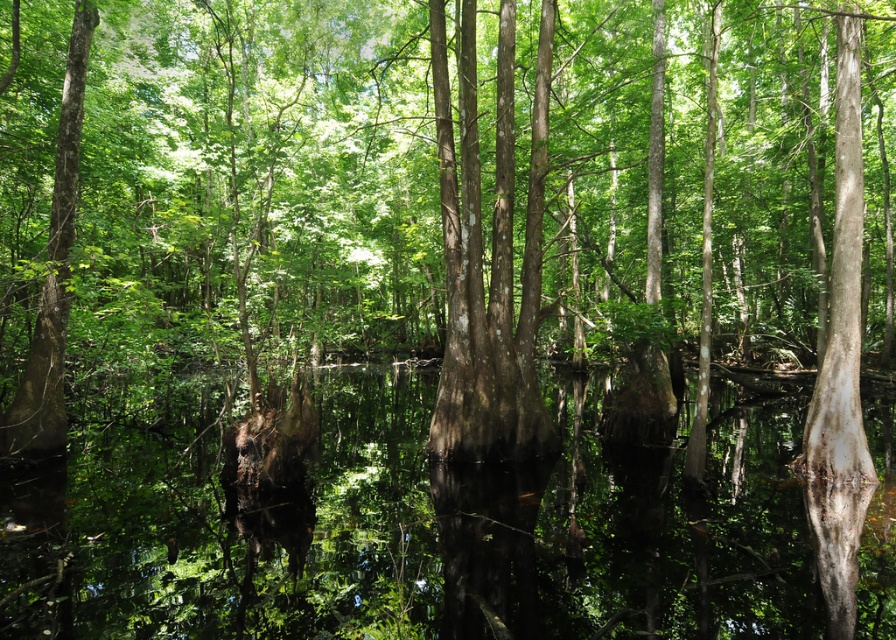
Question: Is smooth bark tree at center wider than transparent water at center?

Choices:
 (A) yes
 (B) no

Answer: (A)

Question: Does smooth bark tree at center have a smaller size compared to transparent water at center?

Choices:
 (A) no
 (B) yes

Answer: (A)

Question: Can you confirm if smooth bark tree at center is positioned to the right of transparent water at center?

Choices:
 (A) no
 (B) yes

Answer: (A)

Question: Which point appears farthest from the camera in this image?

Choices:
 (A) (332, 268)
 (B) (207, 426)

Answer: (A)

Question: Which point is farther from the camera taking this photo?

Choices:
 (A) (317, 509)
 (B) (53, 3)

Answer: (B)

Question: Which of the following is the farthest from the observer?

Choices:
 (A) transparent water at center
 (B) smooth bark tree at center

Answer: (B)